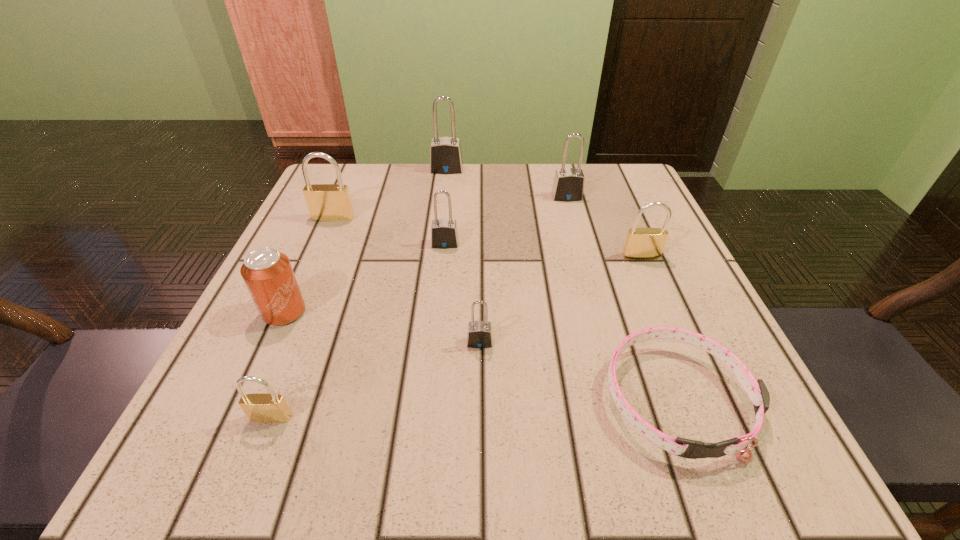
Find the location of `the farthest gray padlock`. the farthest gray padlock is located at coordinates (445, 152).

In order to click on the farthest object in this screenshot , I will do `click(445, 152)`.

At what (x,y) coordinates should I click in order to perform the action: click on the third nearest gray padlock. Please return your answer as a coordinate pair (x, y). Looking at the image, I should click on (568, 185).

Identify the location of the second padlock from right to left. (568, 185).

Find the location of a particular element. the farthest brass padlock is located at coordinates tap(326, 202).

The height and width of the screenshot is (540, 960). Identify the location of the third farthest padlock. (326, 202).

Locate an element on the screen. This screenshot has width=960, height=540. the sixth nearest object is located at coordinates (444, 234).

Find the location of a particular element. This screenshot has height=540, width=960. the second nearest gray padlock is located at coordinates (444, 234).

Identify the location of the fifth farthest object. This screenshot has width=960, height=540. (641, 243).

At what (x,y) coordinates should I click in order to perform the action: click on the third nearest padlock. Please return your answer as a coordinate pair (x, y). Looking at the image, I should click on [x=641, y=243].